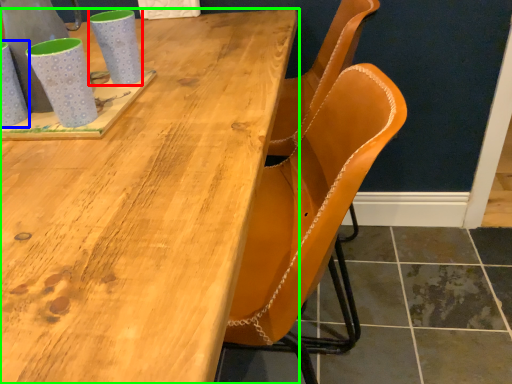
Question: Which object is the farthest from mug (highlighted by a red box)? Choose among these: mug (highlighted by a blue box) or table (highlighted by a green box).

Choices:
 (A) mug
 (B) table

Answer: (B)